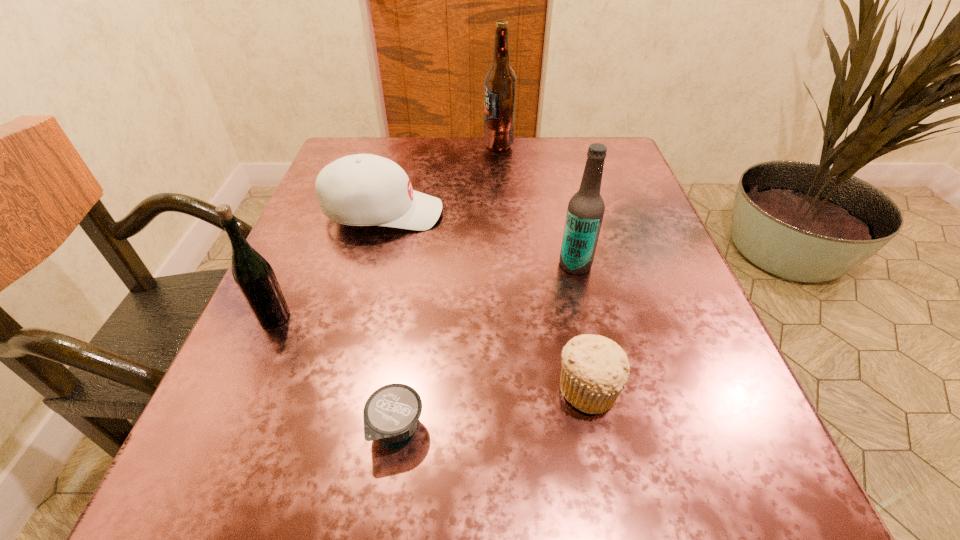
The height and width of the screenshot is (540, 960). I want to click on the farthest beer bottle, so click(x=500, y=80).

You are a GUI agent. You are given a task and a screenshot of the screen. Output one action in this format:
    pyautogui.click(x=<x>, y=<y>)
    Task: Click on the farthest object
    This screenshot has height=540, width=960.
    Given the screenshot: What is the action you would take?
    pyautogui.click(x=500, y=80)

Find the location of a particular element. The width and height of the screenshot is (960, 540). the second farthest beer bottle is located at coordinates (585, 212).

This screenshot has width=960, height=540. I want to click on the rightmost beer bottle, so 585,212.

Find the location of a particular element. the nearest beer bottle is located at coordinates (254, 276).

At what (x,y) coordinates should I click in order to perform the action: click on the third nearest object. Please return your answer as a coordinate pair (x, y). Image resolution: width=960 pixels, height=540 pixels. Looking at the image, I should click on (254, 276).

I want to click on baseball cap, so click(363, 189).

In order to click on the third shortest object in this screenshot , I will do `click(363, 189)`.

Where is `the fifth tallest object`? The image size is (960, 540). the fifth tallest object is located at coordinates (595, 369).

This screenshot has width=960, height=540. What are the coordinates of `the shortest object` in the screenshot? It's located at (392, 412).